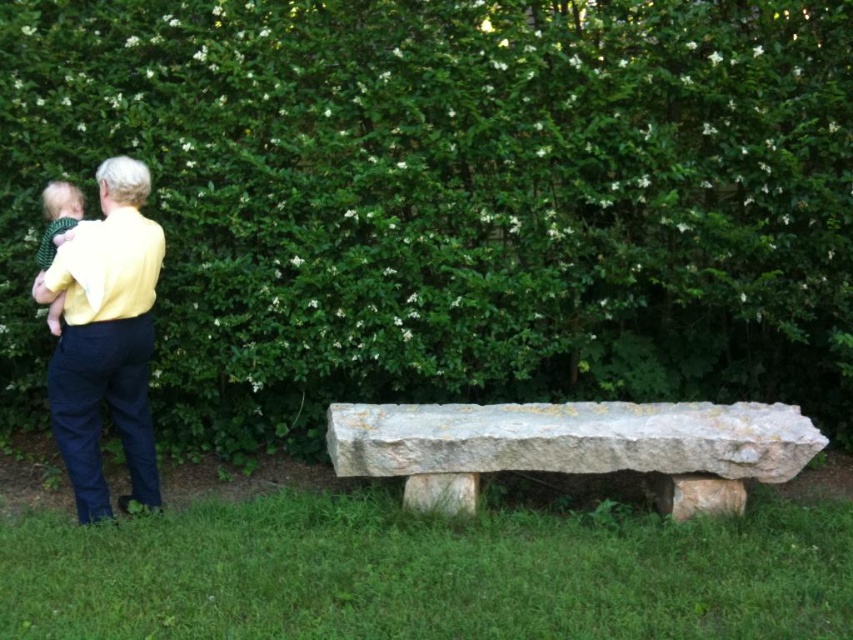
Question: Which object appears closest to the camera in this image?

Choices:
 (A) yellow cotton shirt at left
 (B) white stone bench at center
 (C) green leafy hedge at upper center

Answer: (A)

Question: Which object is positioned farthest from the white stone bench at center?

Choices:
 (A) yellow cotton shirt at left
 (B) green leafy hedge at upper center

Answer: (A)

Question: Is white stone bench at center positioned at the back of yellow cotton shirt at left?

Choices:
 (A) no
 (B) yes

Answer: (B)

Question: Which is farther from the green leafy hedge at upper center?

Choices:
 (A) yellow cotton shirt at left
 (B) white stone bench at center

Answer: (A)

Question: Does green leafy hedge at upper center appear under yellow cotton shirt at left?

Choices:
 (A) yes
 (B) no

Answer: (B)

Question: Where is green leafy hedge at upper center located in relation to white stone bench at center in the image?

Choices:
 (A) right
 (B) left

Answer: (B)